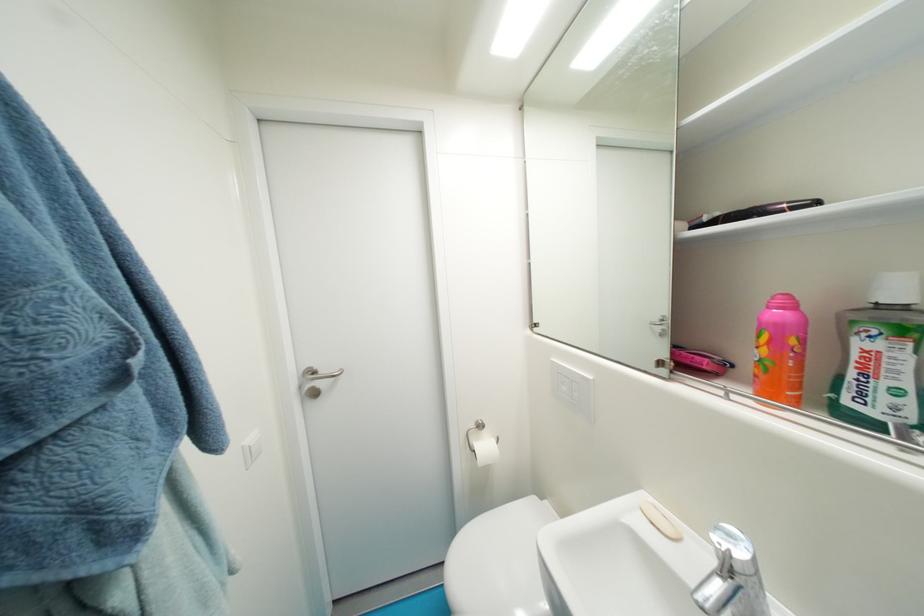
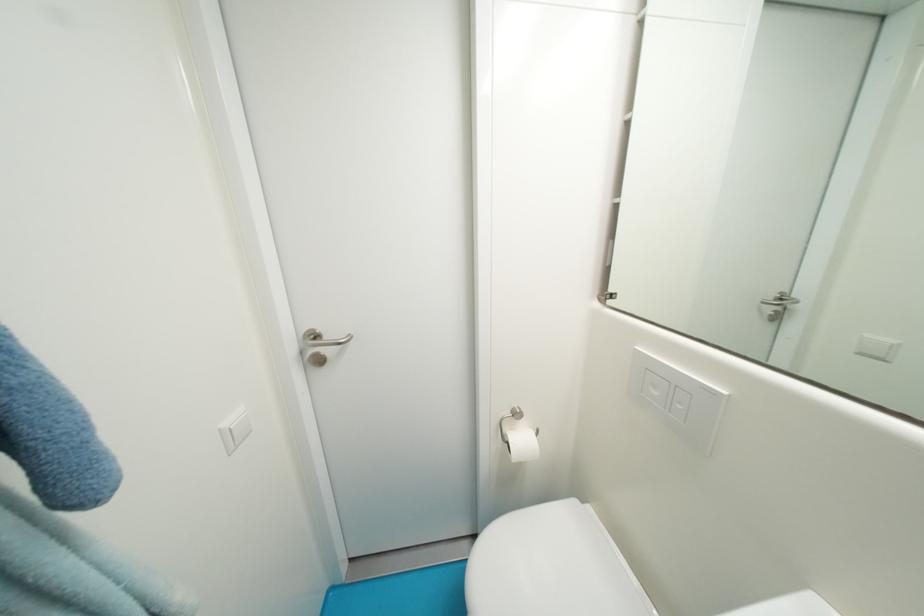
Question: The images are taken continuously from a first-person perspective. In which direction is your viewpoint rotating?

Choices:
 (A) Left
 (B) Right
 (C) Up
 (D) Down

Answer: (D)